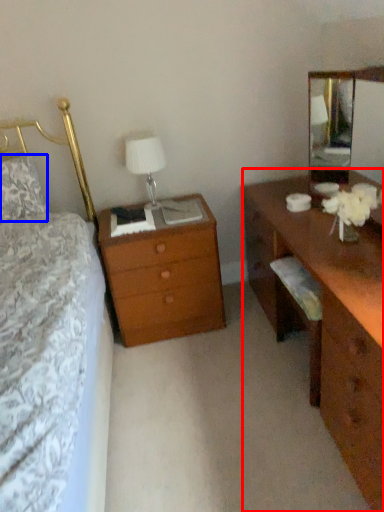
Question: Which point is closer to the camera, desk (highlighted by a red box) or pillow (highlighted by a blue box)?

Choices:
 (A) desk
 (B) pillow

Answer: (A)